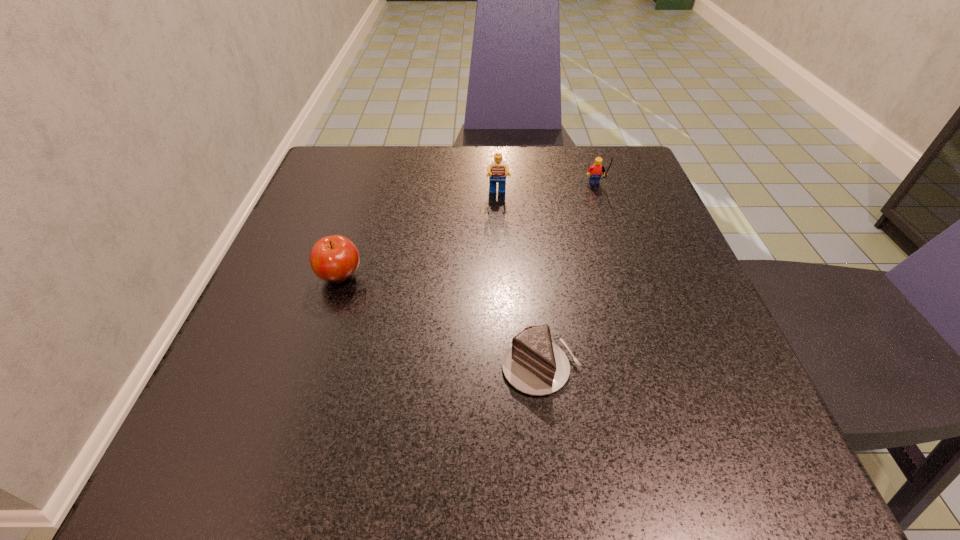
Locate an element on the screen. The image size is (960, 540). the left Lego is located at coordinates (497, 171).

Locate an element on the screen. the rightmost object is located at coordinates (596, 169).

At what (x,y) coordinates should I click in order to perform the action: click on the leftmost object. Please return your answer as a coordinate pair (x, y). The image size is (960, 540). Looking at the image, I should click on (335, 258).

Locate an element on the screen. the third farthest object is located at coordinates (335, 258).

You are a GUI agent. You are given a task and a screenshot of the screen. Output one action in this format:
    pyautogui.click(x=<x>, y=<y>)
    Task: Click on the shortest object
    The height and width of the screenshot is (540, 960).
    Given the screenshot: What is the action you would take?
    (x=533, y=364)

The width and height of the screenshot is (960, 540). I want to click on chocolate cake, so click(533, 364).

At what (x,y) coordinates should I click in order to perform the action: click on vacant area situated on the face of the left Lego. Please return your answer as a coordinate pair (x, y). The height and width of the screenshot is (540, 960). Looking at the image, I should click on (499, 234).

This screenshot has width=960, height=540. In order to click on free space located on the front-facing side of the right Lego in this screenshot , I will do `click(619, 259)`.

Identify the location of blank space located 0.130m on the front of the second nearest object. (315, 357).

This screenshot has height=540, width=960. I want to click on vacant area situated 0.380m on the left of the shortest object, so click(x=242, y=367).